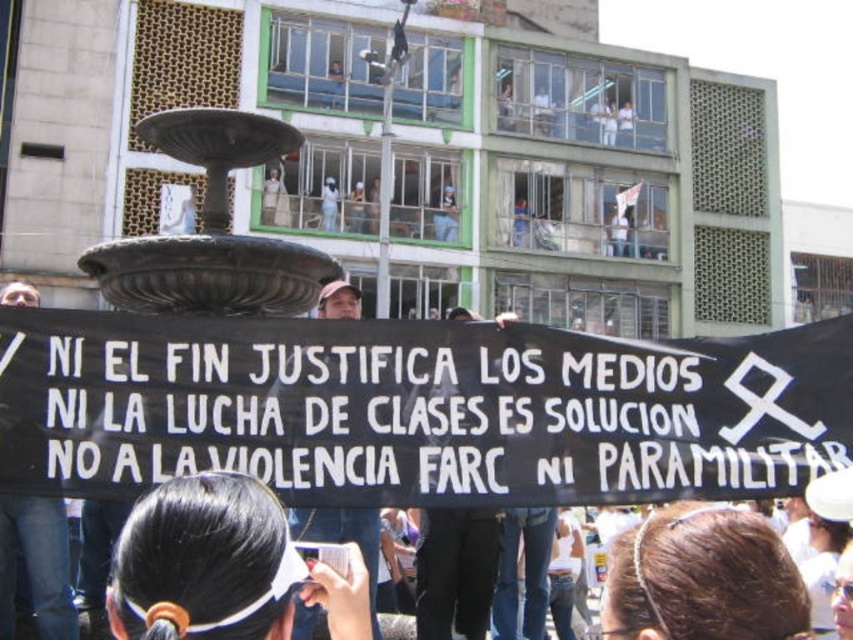
What is located at the coordinates point (223, 566)?

The point (223, 566) indicates black hair at center.

You are a photographer standing in front of the protest scene. You notice the black hair at center and the bronze textured fountain at center. Which object is located below the other?

The black hair at center is positioned under the bronze textured fountain at center, so the black hair at center is below the bronze textured fountain at center.

You are a photographer trying to capture the protest scene. You notice the black hair at center and the bronze textured fountain at center. Which object should you focus on to ensure it takes up more of your photo?

The bronze textured fountain at center should be focused on because it occupies more space than the black hair at center.